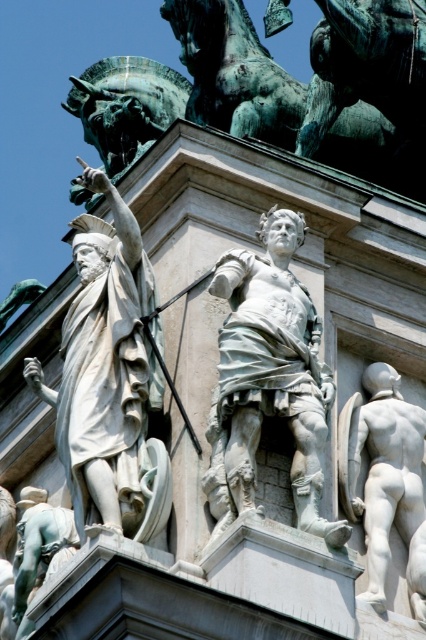
Which is behind, point (115, 324) or point (368, 541)?

The point (368, 541) is more distant.

Between white marble statue at left and white marble nude figure at lower right, which one has more height?

With more height is white marble statue at left.

Which is behind, point (158, 403) or point (379, 593)?

The point (379, 593) is more distant.

Identify the location of white marble statue at left. The image size is (426, 640). (106, 372).

This screenshot has height=640, width=426. What are the coordinates of `white marble statue at left` in the screenshot? It's located at (106, 372).

Between white marble statue at left and white marble statue at center, which one appears on the right side from the viewer's perspective?

white marble statue at center

Is point (100, 272) positioned behind point (245, 410)?

Yes, it is.

Identify the location of white marble statue at left. This screenshot has height=640, width=426. (106, 372).

Is white marble statue at center to the left of white marble nude figure at lower right from the viewer's perspective?

Yes, white marble statue at center is to the left of white marble nude figure at lower right.

Can you confirm if white marble statue at center is positioned to the right of white marble nude figure at lower right?

Incorrect, white marble statue at center is not on the right side of white marble nude figure at lower right.

The image size is (426, 640). In order to click on white marble statue at center in this screenshot , I will do `click(267, 378)`.